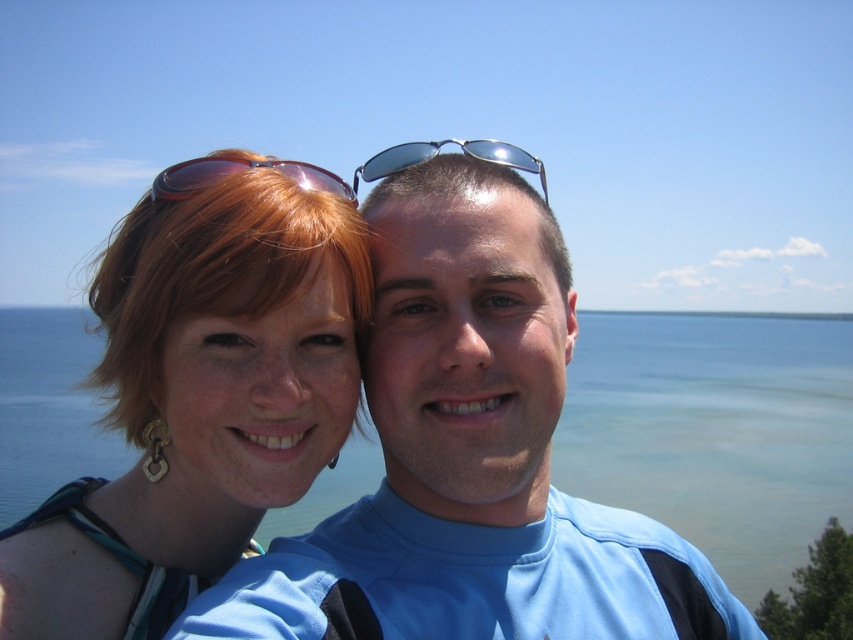
Consider the image. You are a photographer trying to capture the scenic view behind the two people in the image. Which object, the blue water at center or the matte red sunglasses at upper left, is positioned higher in the image?

The blue water at center is taller than the matte red sunglasses at upper left, so the blue water at center is positioned higher in the image.

You are a photographer standing 10 meters away from the two pairs of sunglasses in the image. You want to capture both the matte red sunglasses at upper left and the metallic reflective sunglasses at center in a single photo without moving your position. Can you fit both into your camera frame if your camera has a maximum horizontal field of view of 8 meters?

The matte red sunglasses at upper left and metallic reflective sunglasses at center are 8.64 meters apart. Since the distance between them exceeds the camera frame of 8 meters, you cannot fit both into the photo without moving your position.

You are a photographer trying to capture a closeup of the matte red sunglasses at upper left and the metallic reflective sunglasses at center. Which pair of sunglasses is taller?

The metallic reflective sunglasses at center is taller than the matte red sunglasses at upper left.